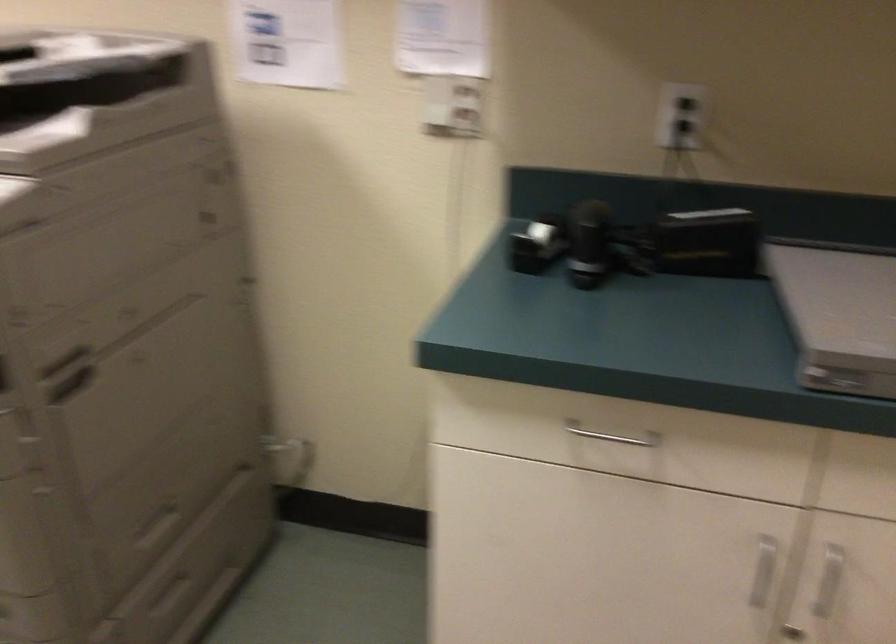
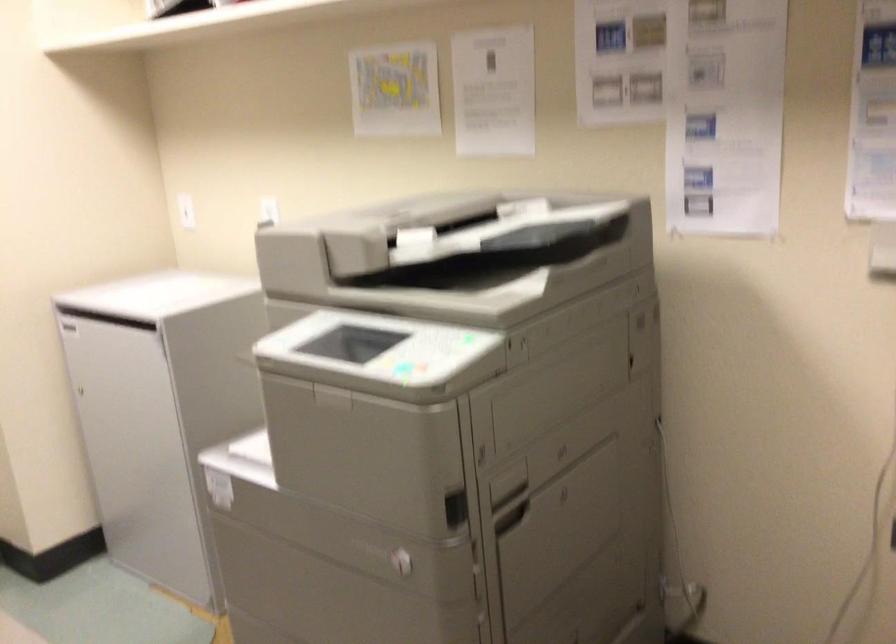
Question: The images are taken continuously from a first-person perspective. In which direction is your viewpoint rotating?

Choices:
 (A) Left
 (B) Right
 (C) Up
 (D) Down

Answer: (A)